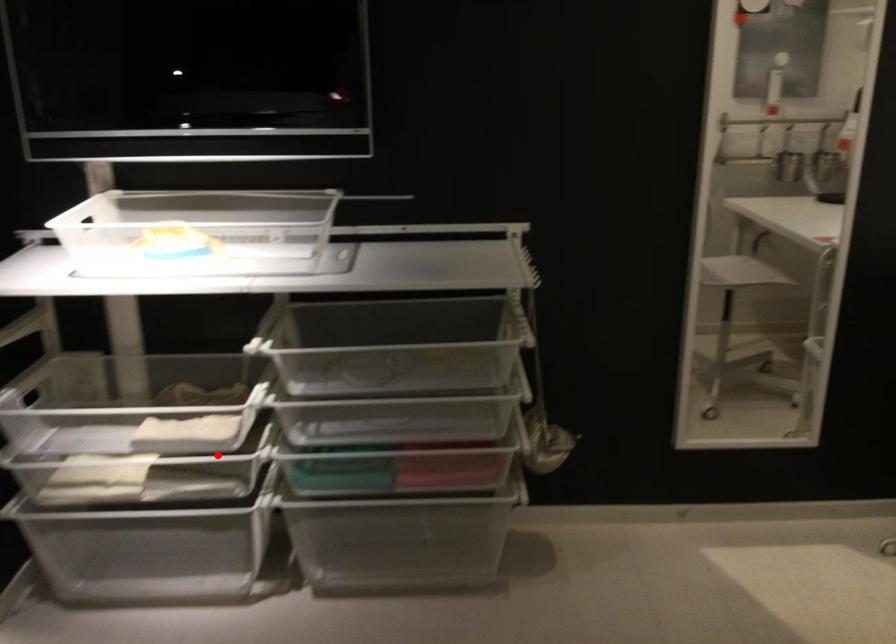
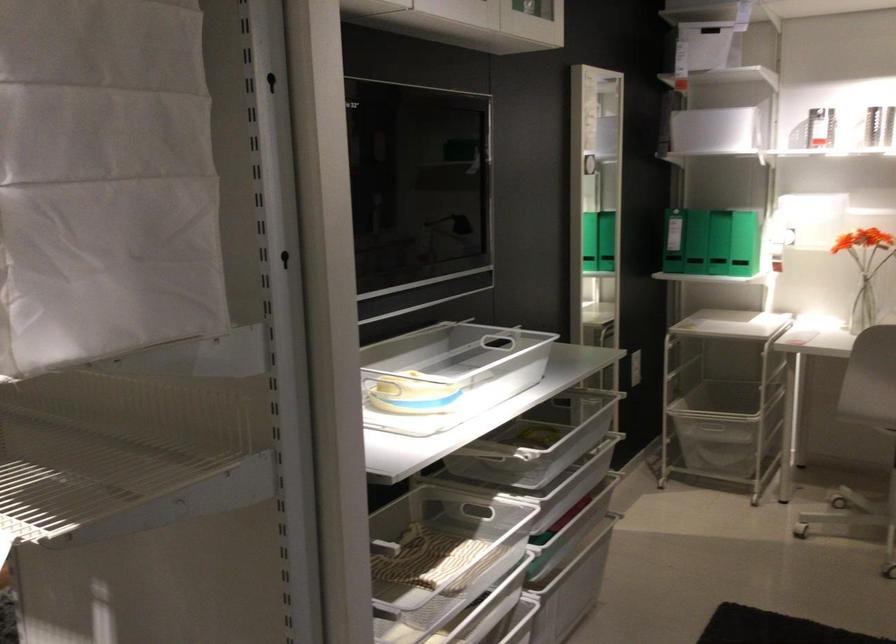
Question: I am providing you with two images of the same scene from different viewpoints. Image1 has a red point marked. In image2, the corresponding 3D location appears at what relative position? Reply with the corresponding letter.

Choices:
 (A) Closer
 (B) Farther

Answer: (B)